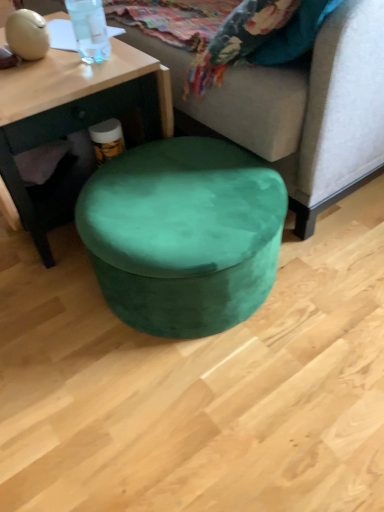
Where is `free location to the left of velvet green ottoman at center`? The image size is (384, 512). free location to the left of velvet green ottoman at center is located at coordinates (47, 321).